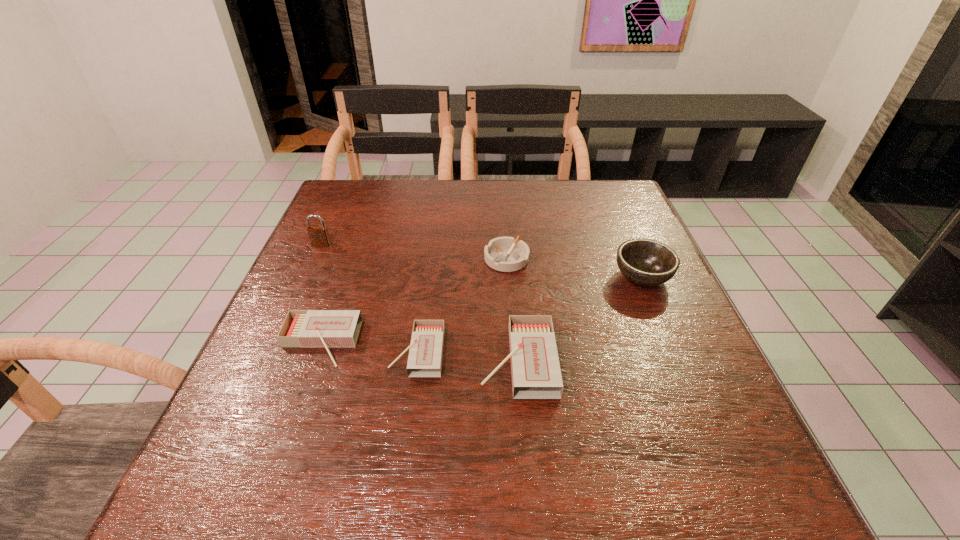
Please point a spot to add another matchbox on the right. Please provide its 2D coordinates. Your answer should be formatted as a tuple, i.e. [(x, y)], where the tuple contains the x and y coordinates of a point satisfying the conditions above.

[(623, 370)]